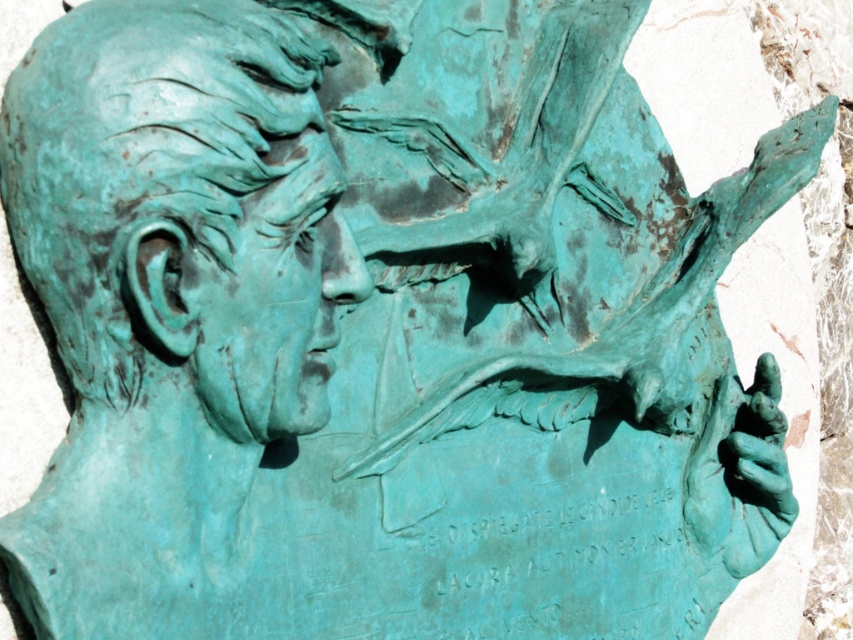
Is green patina bust at center positioned before green patina face at center?

Yes, green patina bust at center is closer to the viewer.

Does green patina bust at center have a greater height compared to green patina face at center?

Indeed, green patina bust at center has a greater height compared to green patina face at center.

Does point (271, 246) come farther from viewer compared to point (309, 208)?

No, it is not.

This screenshot has width=853, height=640. In order to click on green patina bust at center in this screenshot , I will do `click(183, 205)`.